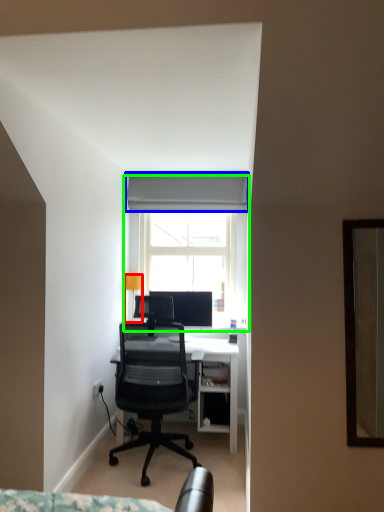
Question: Which object is the farthest from lamp (highlighted by a red box)? Choose among these: curtain (highlighted by a blue box) or window (highlighted by a green box).

Choices:
 (A) curtain
 (B) window

Answer: (A)